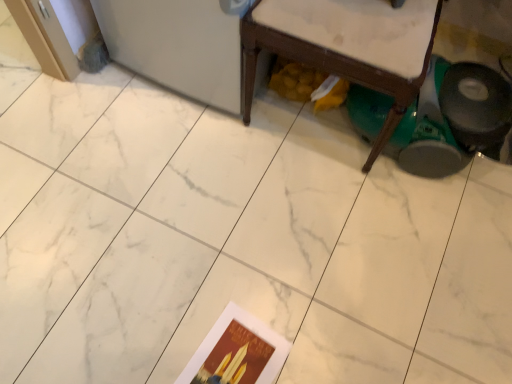
Measure the distance between matte paper postcard at lower center and camera.

The depth of matte paper postcard at lower center is 3.64 feet.

Where is `matte paper postcard at lower center`? The width and height of the screenshot is (512, 384). matte paper postcard at lower center is located at coordinates (237, 352).

What is the approximate width of matte paper postcard at lower center?

matte paper postcard at lower center is 29.29 centimeters in width.

Image resolution: width=512 pixels, height=384 pixels. Describe the element at coordinates (237, 352) in the screenshot. I see `matte paper postcard at lower center` at that location.

Describe the element at coordinates (334, 52) in the screenshot. I see `wooden chair at lower right` at that location.

Locate an element on the screen. This screenshot has width=512, height=384. wooden chair at lower right is located at coordinates (334, 52).

Locate an element on the screen. matte paper postcard at lower center is located at coordinates (237, 352).

Does matte paper postcard at lower center appear on the right side of wooden chair at lower right?

In fact, matte paper postcard at lower center is to the left of wooden chair at lower right.

Is the depth of matte paper postcard at lower center less than that of wooden chair at lower right?

No.

Is point (236, 374) more distant than point (254, 72)?

That is False.

From the image's perspective, relative to wooden chair at lower right, is matte paper postcard at lower center above or below?

matte paper postcard at lower center is below wooden chair at lower right.

From a real-world perspective, is matte paper postcard at lower center above or below wooden chair at lower right?

Clearly, from a real-world perspective, matte paper postcard at lower center is below wooden chair at lower right.

Considering the sizes of objects matte paper postcard at lower center and wooden chair at lower right in the image provided, who is thinner, matte paper postcard at lower center or wooden chair at lower right?

Thinner between the two is matte paper postcard at lower center.

Considering the sizes of objects matte paper postcard at lower center and wooden chair at lower right in the image provided, who is shorter, matte paper postcard at lower center or wooden chair at lower right?

With less height is matte paper postcard at lower center.

Who is smaller, matte paper postcard at lower center or wooden chair at lower right?

Smaller between the two is matte paper postcard at lower center.

Is matte paper postcard at lower center inside or outside of wooden chair at lower right?

matte paper postcard at lower center is spatially situated outside wooden chair at lower right.

Is the surface of matte paper postcard at lower center in direct contact with wooden chair at lower right?

matte paper postcard at lower center and wooden chair at lower right are not in contact.

Is matte paper postcard at lower center looking in the opposite direction of wooden chair at lower right?

Correct, matte paper postcard at lower center is looking away from wooden chair at lower right.

Identify the location of postcard that is on the left side of wooden chair at lower right. (237, 352).

Does wooden chair at lower right appear on the right side of matte paper postcard at lower center?

Yes.

Which object is further away from the camera taking this photo, wooden chair at lower right or matte paper postcard at lower center?

matte paper postcard at lower center is more distant.

Which is in front, point (302, 55) or point (244, 366)?

The point (302, 55) is closer.

From the image's perspective, would you say wooden chair at lower right is positioned over matte paper postcard at lower center?

Yes.

From a real-world perspective, which object stands above the other?

From a 3D spatial view, wooden chair at lower right is above.

Which object is wider, wooden chair at lower right or matte paper postcard at lower center?

wooden chair at lower right is wider.

Who is shorter, wooden chair at lower right or matte paper postcard at lower center?

With less height is matte paper postcard at lower center.

Which of these two, wooden chair at lower right or matte paper postcard at lower center, is smaller?

matte paper postcard at lower center is smaller.

Is wooden chair at lower right not inside matte paper postcard at lower center?

wooden chair at lower right lies outside matte paper postcard at lower center's area.

Would you say wooden chair at lower right is a long distance from matte paper postcard at lower center?

No, wooden chair at lower right is not far away from matte paper postcard at lower center.

Is wooden chair at lower right turned away from matte paper postcard at lower center?

wooden chair at lower right is not turned away from matte paper postcard at lower center.

How different are the orientations of wooden chair at lower right and matte paper postcard at lower center in degrees?

The angle between the facing direction of wooden chair at lower right and the facing direction of matte paper postcard at lower center is 10.9 degrees.

This screenshot has height=384, width=512. I want to click on furniture above the matte paper postcard at lower center (from the image's perspective), so (x=334, y=52).

At what (x,y) coordinates should I click in order to perform the action: click on postcard below the wooden chair at lower right (from the image's perspective). Please return your answer as a coordinate pair (x, y). Looking at the image, I should click on (237, 352).

Where is `furniture lying on the right of matte paper postcard at lower center`? The width and height of the screenshot is (512, 384). furniture lying on the right of matte paper postcard at lower center is located at coordinates (334, 52).